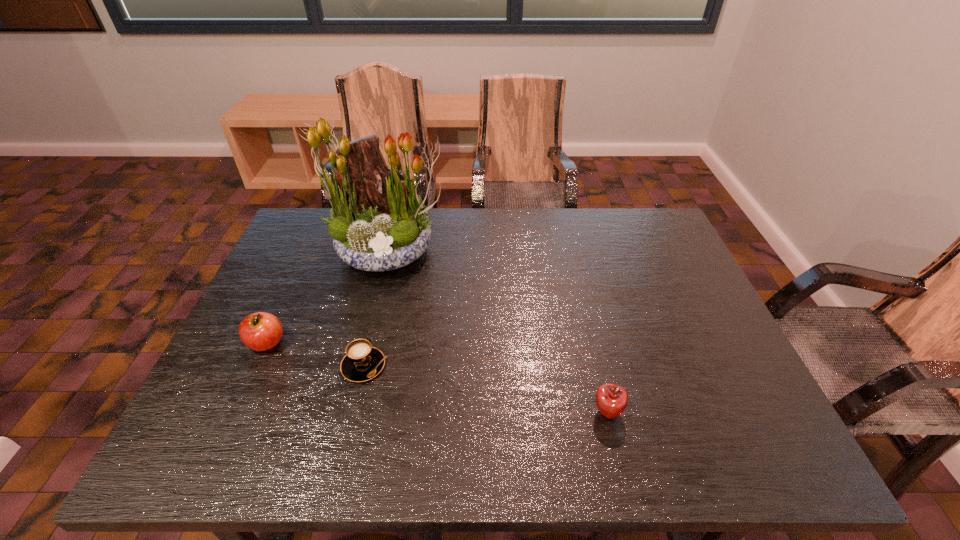
Find the location of a particular element. The image size is (960, 540). free space between the cappuccino and the right apple is located at coordinates (486, 389).

You are a GUI agent. You are given a task and a screenshot of the screen. Output one action in this format:
    pyautogui.click(x=<x>, y=<y>)
    Task: Click on the free space between the leftmost object and the flower arrangement
    The width and height of the screenshot is (960, 540).
    Given the screenshot: What is the action you would take?
    pyautogui.click(x=327, y=297)

At what (x,y) coordinates should I click in order to perform the action: click on vacant space in between the cappuccino and the leftmost object. Please return your answer as a coordinate pair (x, y). This screenshot has width=960, height=540. Looking at the image, I should click on tap(315, 354).

The width and height of the screenshot is (960, 540). I want to click on object that is the closest to the rightmost object, so click(x=362, y=362).

Where is `object that stands as the second closest to the cappuccino`? This screenshot has width=960, height=540. object that stands as the second closest to the cappuccino is located at coordinates (372, 229).

Locate an element on the screen. blank space that satisfies the following two spatial constraints: 1. on the front-facing side of the tallest object; 2. on the right side of the shortest object is located at coordinates (359, 366).

Identify the location of free space that satisfies the following two spatial constraints: 1. on the front side of the shortest object; 2. on the left side of the left apple. (256, 366).

Where is `vacant point that satisfies the following two spatial constraints: 1. on the front-facing side of the right apple; 2. on the left side of the farthest object`? The image size is (960, 540). vacant point that satisfies the following two spatial constraints: 1. on the front-facing side of the right apple; 2. on the left side of the farthest object is located at coordinates (348, 413).